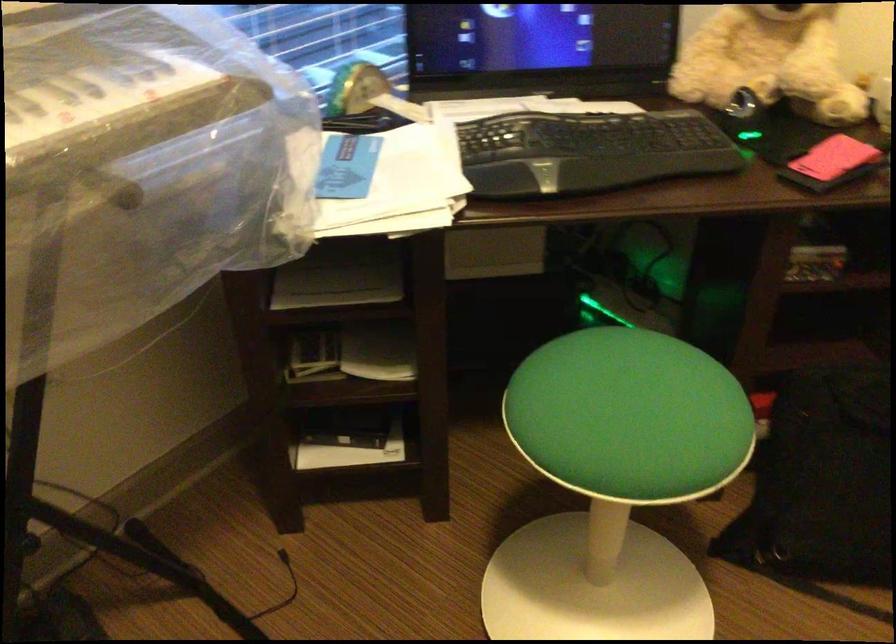
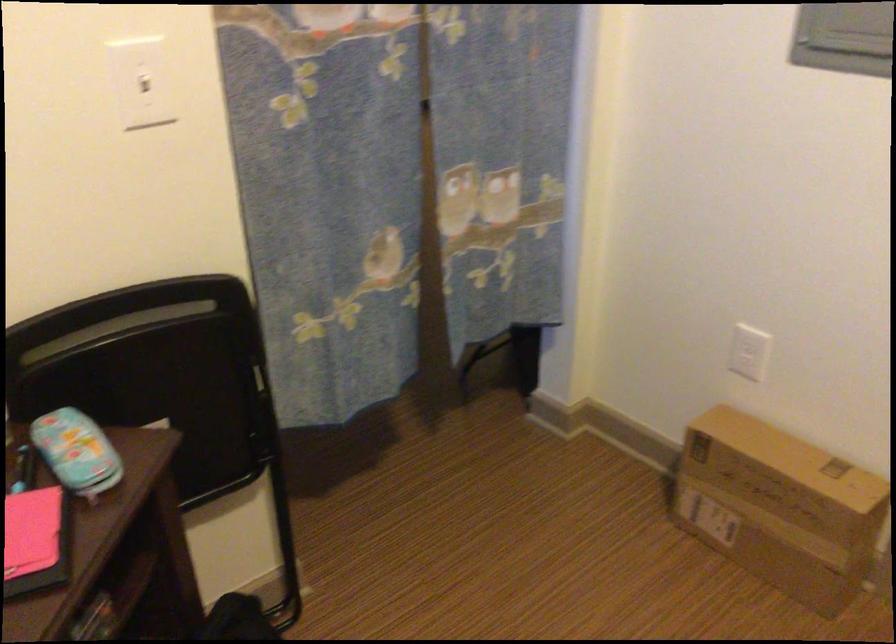
The first image is from the beginning of the video and the second image is from the end. How did the camera likely rotate when shooting the video?

The camera rotated toward right-down.